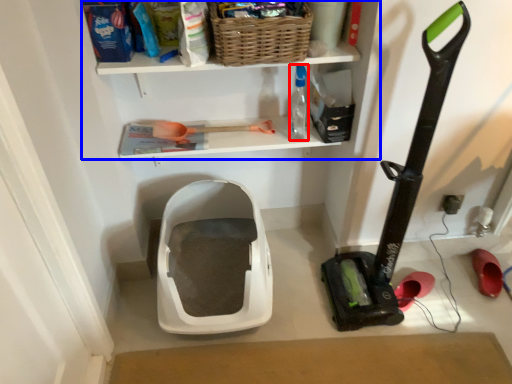
Question: Which point is further to the camera, bottle (highlighted by a red box) or shelf (highlighted by a blue box)?

Choices:
 (A) bottle
 (B) shelf

Answer: (A)